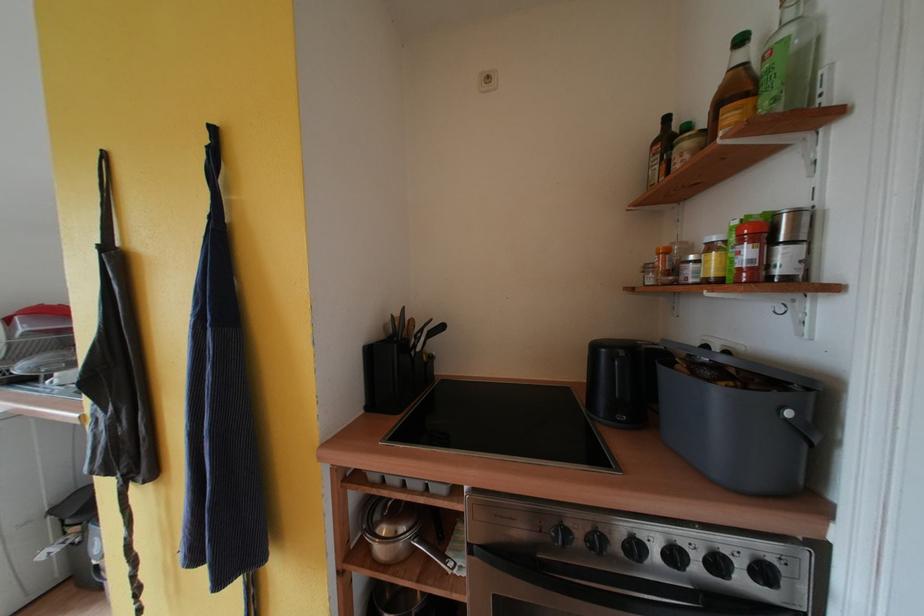
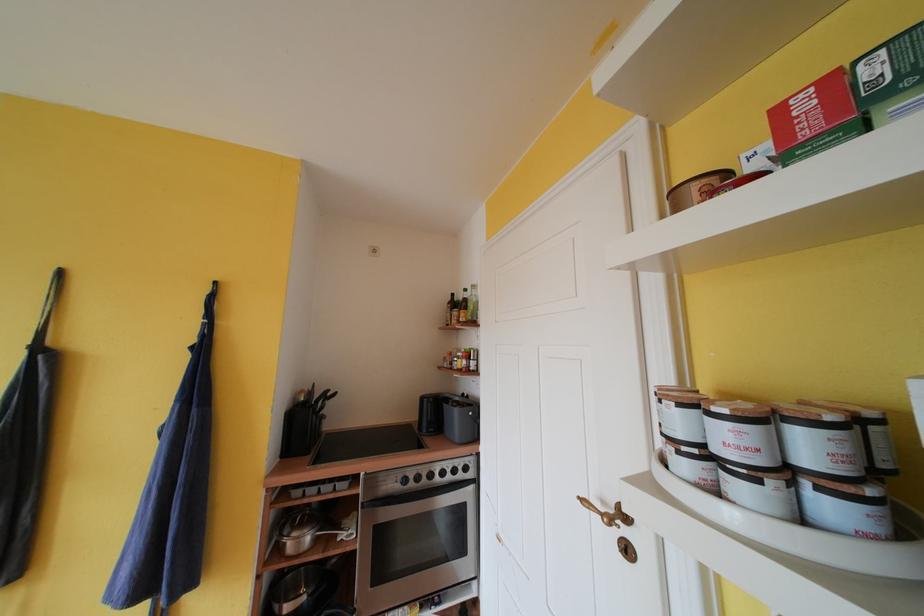
Locate, in the second image, the point that corresponds to (553,512) in the first image.

(406, 474)